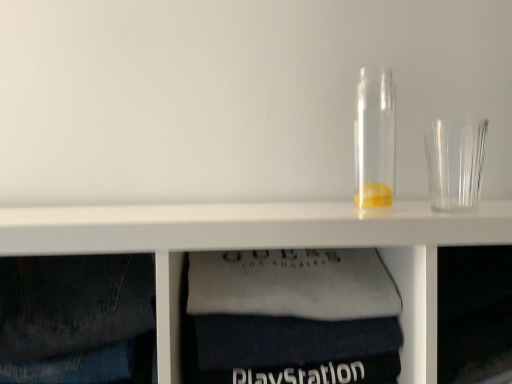
Question: Is point pos(381,105) positioned closer to the camera than point pos(247,263)?

Choices:
 (A) closer
 (B) farther

Answer: (B)

Question: Do you think transparent glass jar at center is within white fabric at lower center, or outside of it?

Choices:
 (A) inside
 (B) outside

Answer: (B)

Question: Which object is positioned closest to the transparent plastic shot glass at right?

Choices:
 (A) transparent glass jar at center
 (B) white fabric at lower center

Answer: (A)

Question: Which object is positioned farthest from the white fabric at lower center?

Choices:
 (A) transparent plastic shot glass at right
 (B) transparent glass jar at center

Answer: (A)